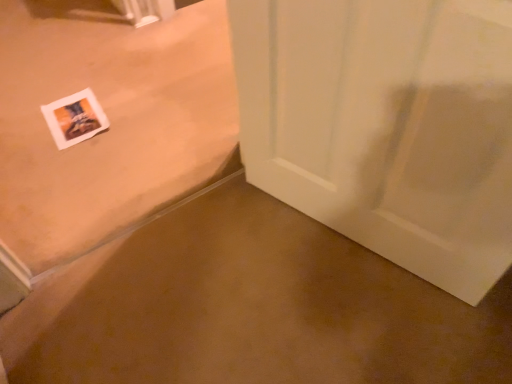
Image resolution: width=512 pixels, height=384 pixels. I want to click on white paper postcard at lower left, so click(x=75, y=118).

Describe the element at coordinates (75, 118) in the screenshot. I see `white paper postcard at lower left` at that location.

In order to face white paper postcard at lower left, should I rotate leftwards or rightwards?

A 22.874 degree turn to the left will do.

Identify the location of white paper postcard at lower left. The height and width of the screenshot is (384, 512). (75, 118).